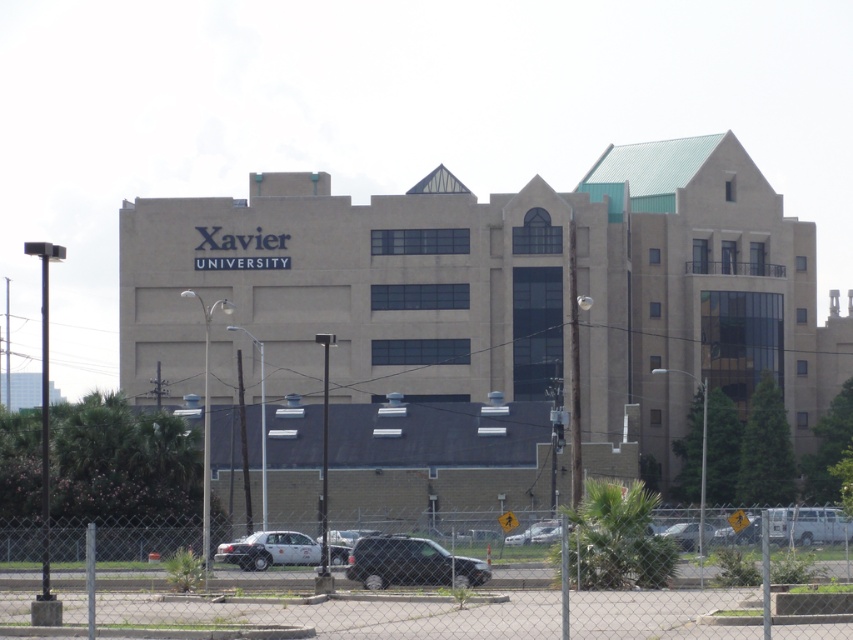
Question: Does chain-link fence at lower center lie in front of shiny black suv at lower center?

Choices:
 (A) no
 (B) yes

Answer: (B)

Question: Does white matte sedan at lower center appear over silver metallic car at lower center?

Choices:
 (A) no
 (B) yes

Answer: (A)

Question: Which point is farther from the camera taking this photo?

Choices:
 (A) (538, 538)
 (B) (345, 547)

Answer: (B)

Question: Which object is farther from the camera taking this photo?

Choices:
 (A) silver metallic sedan at lower right
 (B) shiny black suv at lower center

Answer: (B)

Question: Estimate the real-world distances between objects in this image. Which object is farther from the shiny black suv at lower center?

Choices:
 (A) white matte sedan at lower center
 (B) silver metallic car at lower center
 (C) silver metallic sedan at lower right
 (D) chain-link fence at lower center

Answer: (C)

Question: Can you confirm if shiny black suv at lower center is smaller than silver metallic sedan at lower right?

Choices:
 (A) no
 (B) yes

Answer: (A)